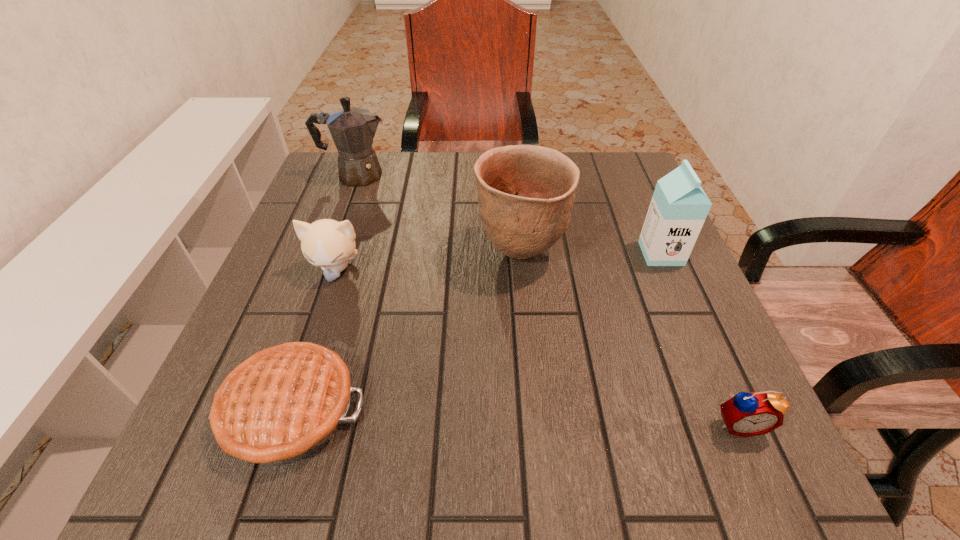
This screenshot has height=540, width=960. Find the location of `coffeepot`. coffeepot is located at coordinates (353, 129).

This screenshot has width=960, height=540. Identify the location of the fourth object from left to right. (526, 193).

The image size is (960, 540). I want to click on milk carton, so click(x=679, y=206).

Image resolution: width=960 pixels, height=540 pixels. Find the location of `kitten`. kitten is located at coordinates (326, 243).

The height and width of the screenshot is (540, 960). What are the coordinates of `alarm clock` in the screenshot? It's located at (745, 414).

Find the location of a particular element. pie is located at coordinates (282, 404).

Find the location of a particular element. free region located 0.360m on the pouring side of the coffeepot is located at coordinates (x=528, y=176).

Image resolution: width=960 pixels, height=540 pixels. Identify the location of free space located 0.050m on the front of the pottery. (525, 304).

Where is `free region located on the back of the milk carton`? free region located on the back of the milk carton is located at coordinates (624, 167).

At what (x,y) coordinates should I click in order to perform the action: click on vacant space located 0.260m on the face of the fourth tallest object. Please return your answer as a coordinate pair (x, y). The height and width of the screenshot is (540, 960). Looking at the image, I should click on (291, 405).